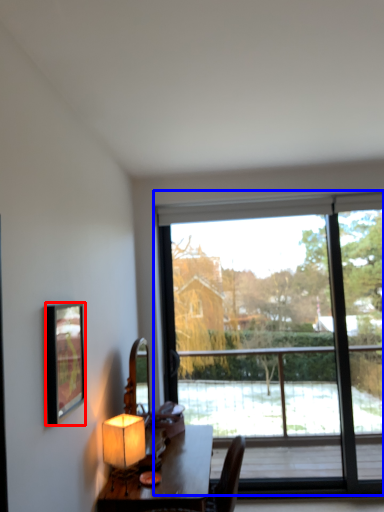
Question: Among these objects, which one is nearest to the camera, picture frame (highlighted by a red box) or window (highlighted by a blue box)?

Choices:
 (A) picture frame
 (B) window

Answer: (A)